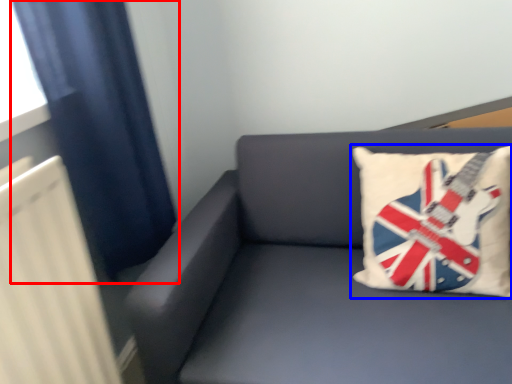
Question: Among these objects, which one is nearest to the camera, curtain (highlighted by a red box) or pillow (highlighted by a blue box)?

Choices:
 (A) curtain
 (B) pillow

Answer: (A)